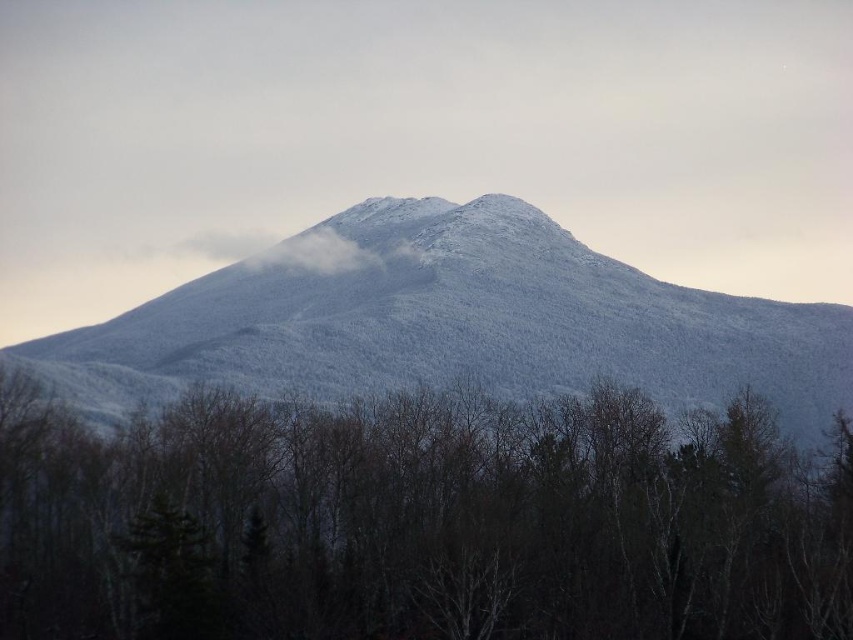
Question: Does white matte tree at center appear on the right side of white frosty mountain at center?

Choices:
 (A) no
 (B) yes

Answer: (B)

Question: Among these objects, which one is farthest from the camera?

Choices:
 (A) white matte tree at center
 (B) white frosty mountain at center
 (C) white fluffy cloud at upper center

Answer: (C)

Question: Which of the following is the farthest from the observer?

Choices:
 (A) (360, 301)
 (B) (490, 476)
 (C) (309, 262)

Answer: (C)

Question: Can you confirm if white matte tree at center is smaller than white frosty mountain at center?

Choices:
 (A) no
 (B) yes

Answer: (B)

Question: Which object is positioned closest to the white matte tree at center?

Choices:
 (A) white fluffy cloud at upper center
 (B) white frosty mountain at center

Answer: (B)

Question: Is the position of white matte tree at center less distant than that of white frosty mountain at center?

Choices:
 (A) yes
 (B) no

Answer: (A)